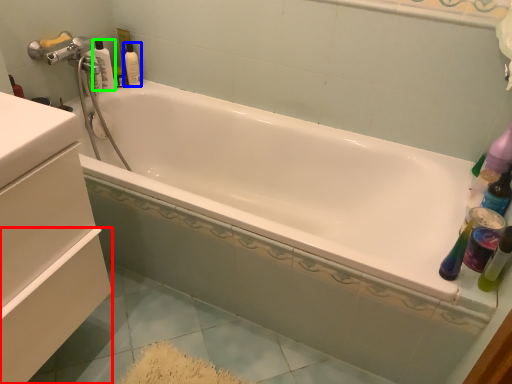
Question: Which is farther away from drawer (highlighted by a red box)? mouthwash (highlighted by a blue box) or bottle (highlighted by a green box)?

Choices:
 (A) mouthwash
 (B) bottle

Answer: (A)